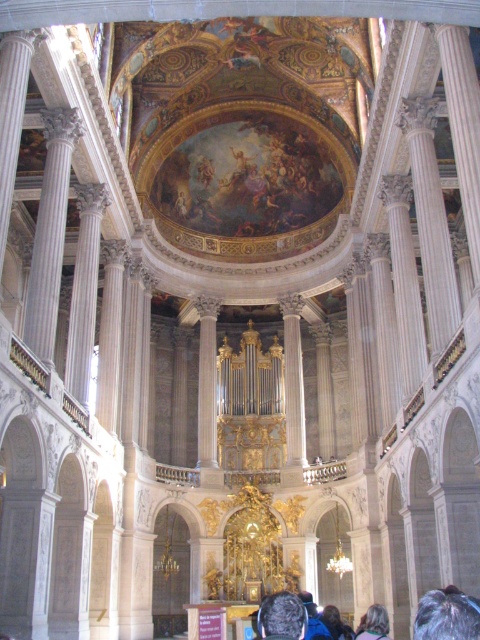
Who is higher up, dark gray hair at center or gray hair at lower right?

dark gray hair at center is above.

Between point (263, 604) and point (376, 612), which one is positioned behind?

The point (263, 604) is more distant.

Which is behind, point (264, 608) or point (374, 632)?

Positioned behind is point (374, 632).

Locate an element on the screen. The image size is (480, 640). dark gray hair at center is located at coordinates (282, 616).

Is gray hair at upper center wider than gray fabric headband at center?

Indeed, gray hair at upper center has a greater width compared to gray fabric headband at center.

Is gray hair at upper center thinner than gray fabric headband at center?

No, gray hair at upper center is not thinner than gray fabric headband at center.

Identify the location of gray hair at upper center. (446, 616).

Locate an element on the screen. gray hair at upper center is located at coordinates (446, 616).

Is gray hair at lower right shorter than gray fabric headband at center?

Yes.

Who is lower down, gray hair at lower right or gray fabric headband at center?

gray fabric headband at center is below.

Between point (381, 605) and point (340, 637), which one is positioned in front?

Point (340, 637)

You are a GUI agent. You are given a task and a screenshot of the screen. Output one action in this format:
    pyautogui.click(x=<x>, y=<y>)
    Task: Click on the gray hair at lower right
    This screenshot has height=640, width=480.
    Given the screenshot: What is the action you would take?
    pyautogui.click(x=373, y=624)